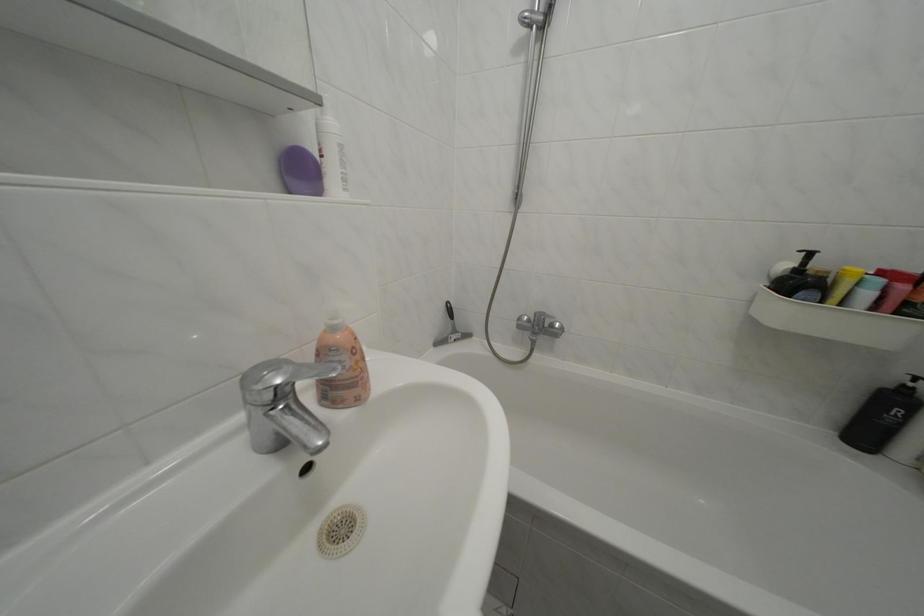
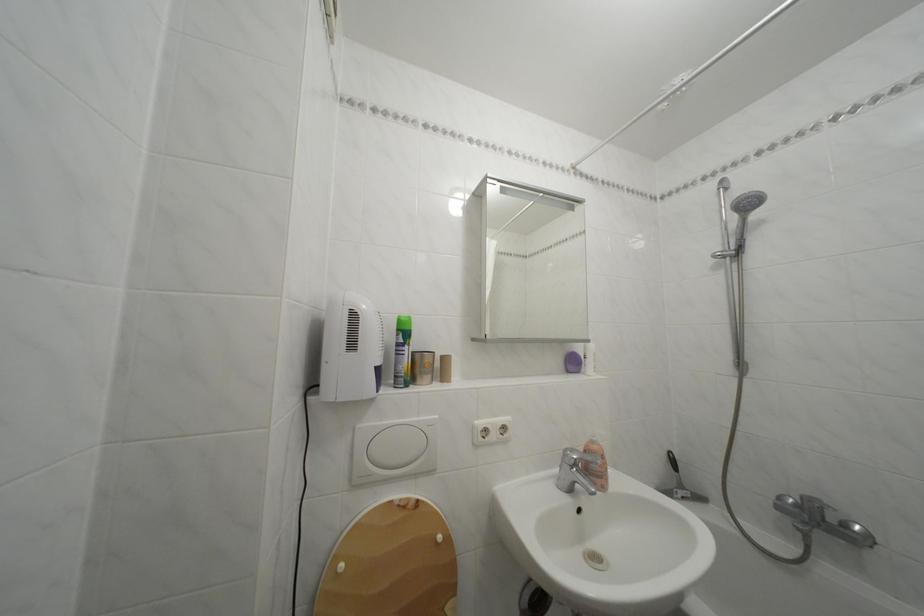
Where in the second image is the point corresponding to point (464, 338) from the first image?

(689, 492)